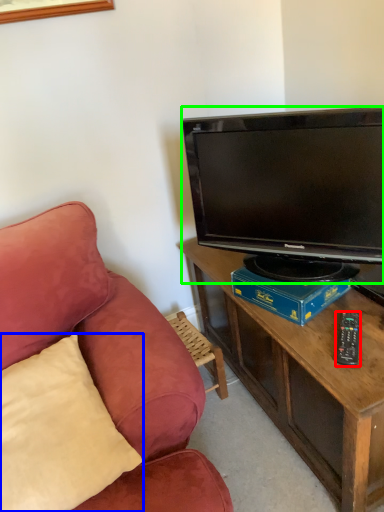
Question: Which is nearer to the remote control (highlighted by a red box)? pillow (highlighted by a blue box) or television (highlighted by a green box).

Choices:
 (A) pillow
 (B) television

Answer: (B)